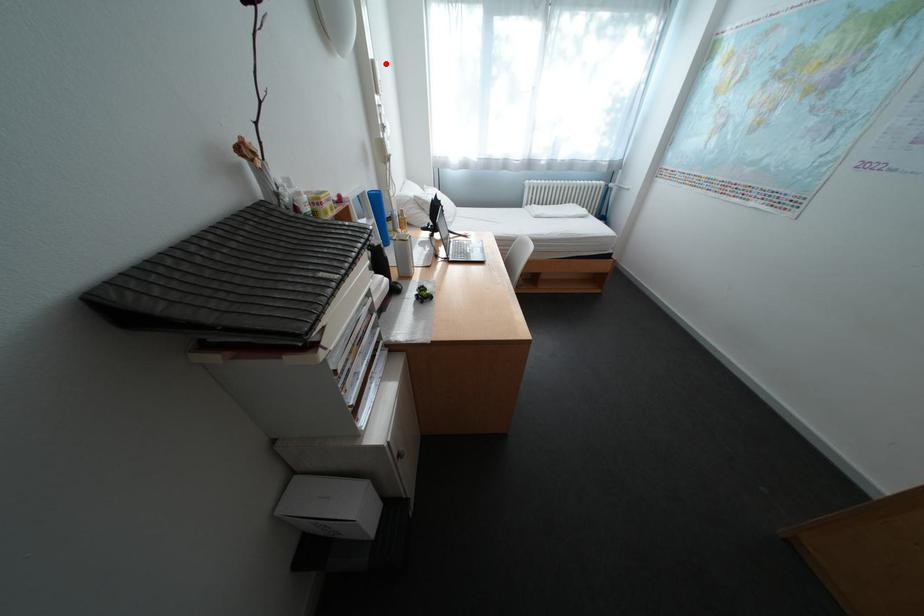
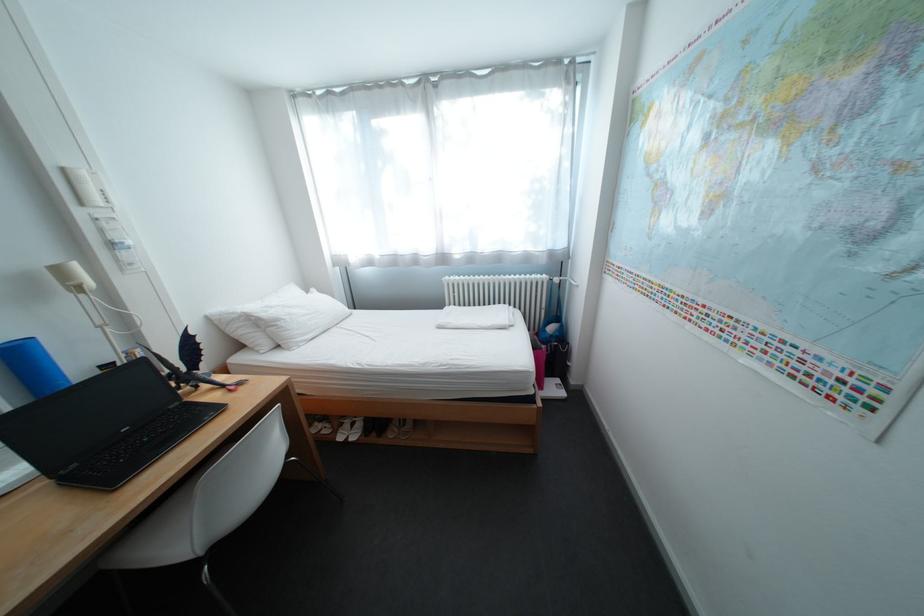
Question: I am providing you with two images of the same scene from different viewpoints. A red point is marked on the first image. At the location where the point appears in image 1, is it still visible in image 2?

Choices:
 (A) Yes
 (B) No

Answer: (A)